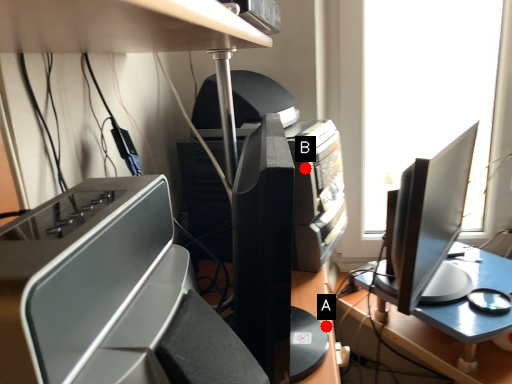
Question: Two points are circled on the image, labeled by A and B beside each circle. Which of the following is the closest to the observer?

Choices:
 (A) A is closer
 (B) B is closer

Answer: (A)